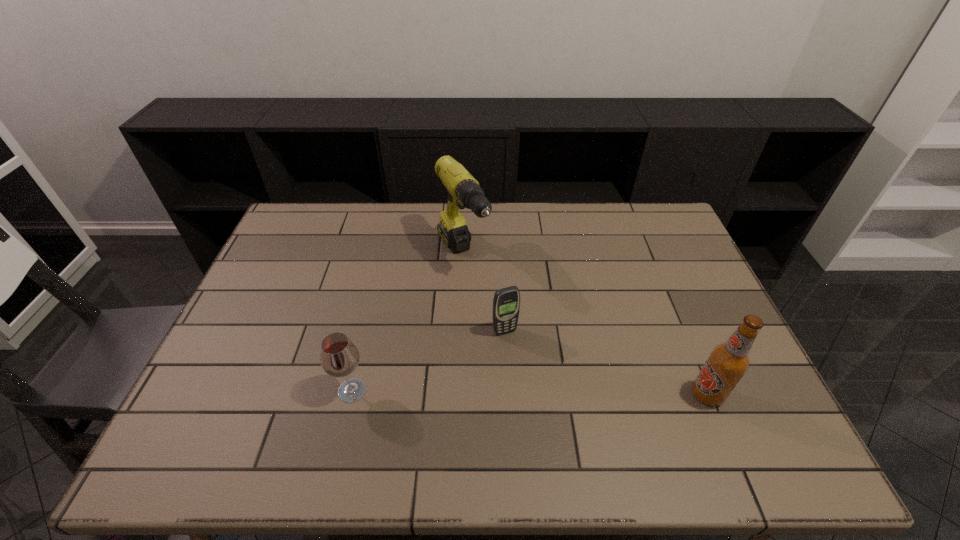
Locate an element on the screen. free space between the leftmost object and the rightmost object is located at coordinates (530, 393).

Locate an element on the screen. The width and height of the screenshot is (960, 540). free spot between the leftmost object and the drill is located at coordinates (407, 323).

Locate an element on the screen. empty space between the leftmost object and the farthest object is located at coordinates (407, 323).

This screenshot has height=540, width=960. Identify the location of free space that is in between the wineglass and the farthest object. (407, 323).

This screenshot has height=540, width=960. In order to click on vacant region between the leftmost object and the third object from right to left in this screenshot , I will do `click(407, 323)`.

At what (x,y) coordinates should I click in order to perform the action: click on unoccupied area between the leftmost object and the farthest object. Please return your answer as a coordinate pair (x, y). Looking at the image, I should click on (407, 323).

This screenshot has height=540, width=960. I want to click on free space that is in between the drill and the beer bottle, so click(x=585, y=326).

I want to click on object that is the closest to the second object from right to left, so [463, 189].

Find the location of a particular element. object that is the second closest to the rightmost object is located at coordinates (463, 189).

What are the coordinates of `free location that satisfies the following two spatial constraints: 1. on the front side of the rightmost object; 2. on the front label of the cellular telephone` in the screenshot? It's located at (508, 395).